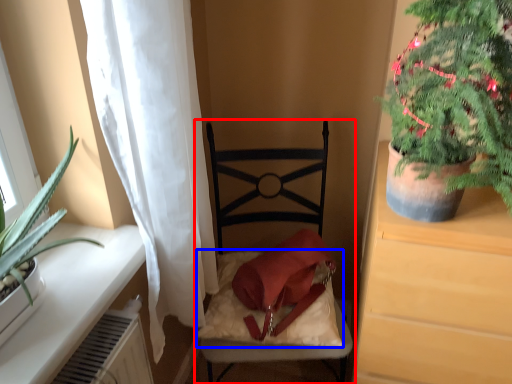
Question: Which object is further to the camera taking this photo, chair (highlighted by a red box) or pillow (highlighted by a blue box)?

Choices:
 (A) chair
 (B) pillow

Answer: (B)